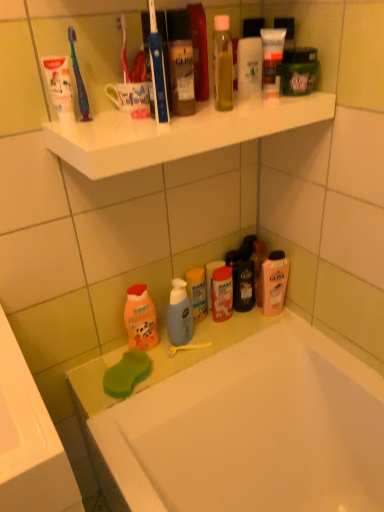
Question: Is blue plastic toothbrush at upper center, which appears as the first toothbrush when viewed from the right, aimed at multicolored plastic toothbrush at upper left, the 1th toothbrush in the left-to-right sequence?

Choices:
 (A) no
 (B) yes

Answer: (A)

Question: Does blue plastic toothbrush at upper center, the 2th toothbrush from the left, lie in front of multicolored plastic toothbrush at upper left, which is the second toothbrush from right to left?

Choices:
 (A) yes
 (B) no

Answer: (A)

Question: Is blue plastic toothbrush at upper center, the 2th toothbrush from the left, not near multicolored plastic toothbrush at upper left, which is the second toothbrush from right to left?

Choices:
 (A) yes
 (B) no

Answer: (B)

Question: Is blue plastic toothbrush at upper center, which appears as the first toothbrush when viewed from the right, positioned with its back to multicolored plastic toothbrush at upper left, which is the second toothbrush from right to left?

Choices:
 (A) no
 (B) yes

Answer: (A)

Question: From the image's perspective, is blue plastic toothbrush at upper center, which appears as the first toothbrush when viewed from the right, on multicolored plastic toothbrush at upper left, the 1th toothbrush in the left-to-right sequence?

Choices:
 (A) yes
 (B) no

Answer: (B)

Question: From the image's perspective, is translucent plastic shampoo bottle at lower center, which is the first toiletry in back-to-front order, above or below white glossy bathtub at lower center?

Choices:
 (A) below
 (B) above

Answer: (B)

Question: Considering the positions of translucent plastic shampoo bottle at lower center, which is the first toiletry in back-to-front order, and white glossy bathtub at lower center in the image, is translucent plastic shampoo bottle at lower center, which is the first toiletry in back-to-front order, wider or thinner than white glossy bathtub at lower center?

Choices:
 (A) wide
 (B) thin

Answer: (B)

Question: Visually, is translucent plastic shampoo bottle at lower center, which is the 4th toiletry in top-to-bottom order, positioned to the left or to the right of white glossy bathtub at lower center?

Choices:
 (A) right
 (B) left

Answer: (B)

Question: Is translucent plastic shampoo bottle at lower center, which is the first toiletry in back-to-front order, inside or outside of white glossy bathtub at lower center?

Choices:
 (A) inside
 (B) outside

Answer: (B)

Question: From the image's perspective, relative to matte plastic bottle at center, which is the third toiletry in top-to-bottom order, is white glossy bathtub at lower center above or below?

Choices:
 (A) below
 (B) above

Answer: (A)

Question: In the image, is white glossy bathtub at lower center on the left side or the right side of matte plastic bottle at center, the second toiletry in the back-to-front sequence?

Choices:
 (A) right
 (B) left

Answer: (A)

Question: From their relative heights in the image, would you say white glossy bathtub at lower center is taller or shorter than matte plastic bottle at center, which is the third toiletry in top-to-bottom order?

Choices:
 (A) tall
 (B) short

Answer: (A)

Question: From a real-world perspective, relative to matte plastic bottle at center, acting as the 3th toiletry starting from the front, is white glossy bathtub at lower center vertically above or below?

Choices:
 (A) above
 (B) below

Answer: (B)

Question: Relative to matte plastic bottle at center, the 2th toiletry positioned from the bottom, is translucent plastic shampoo bottle at lower center, which is the first toiletry in back-to-front order, in front or behind?

Choices:
 (A) front
 (B) behind

Answer: (B)

Question: Based on their sizes in the image, would you say translucent plastic shampoo bottle at lower center, which is the 4th toiletry in top-to-bottom order, is bigger or smaller than matte plastic bottle at center, the second toiletry in the back-to-front sequence?

Choices:
 (A) small
 (B) big

Answer: (A)